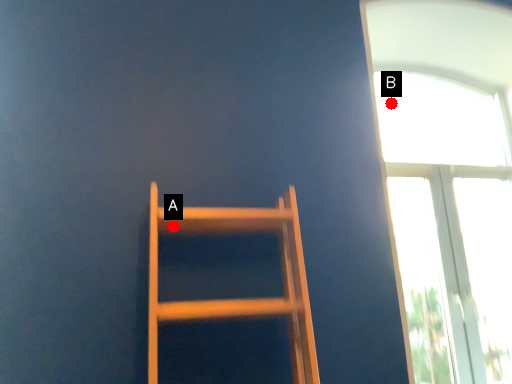
Question: Two points are circled on the image, labeled by A and B beside each circle. Which point appears farthest from the camera in this image?

Choices:
 (A) A is further
 (B) B is further

Answer: (B)